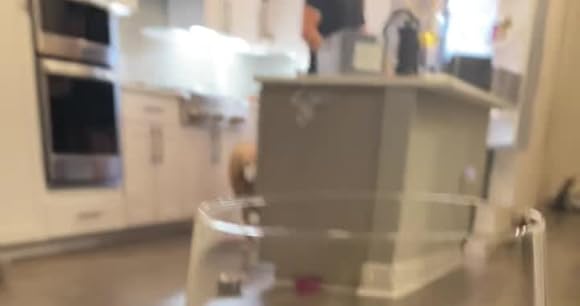
Image resolution: width=580 pixels, height=306 pixels. I want to click on main oven, so click(x=94, y=130).